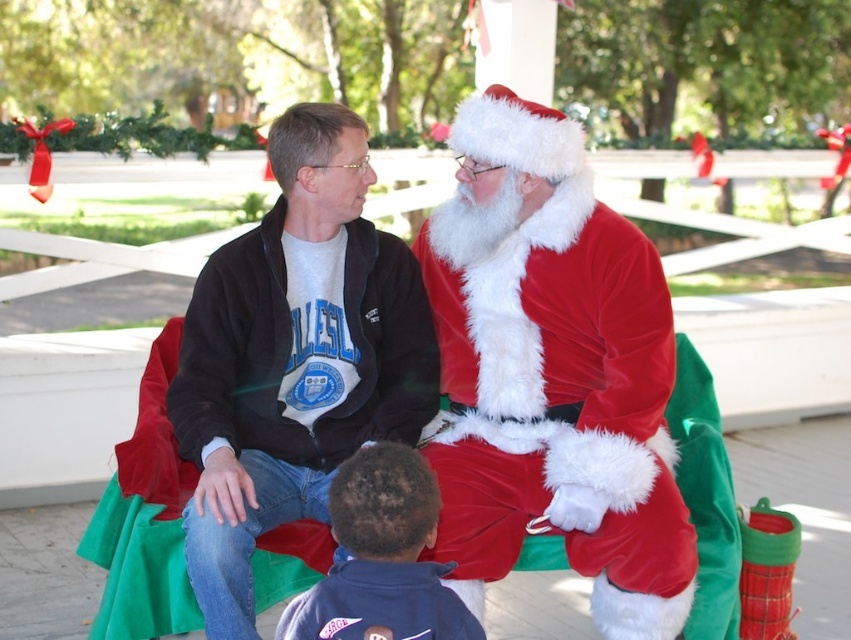
Question: Does velvet santa claus at center have a larger size compared to dark blue fleece jacket at lower center?

Choices:
 (A) yes
 (B) no

Answer: (A)

Question: Which point is closer to the camera?

Choices:
 (A) dark blue fleece jacket at lower center
 (B) velvet santa claus at center

Answer: (A)

Question: Can you confirm if velvet santa claus at center is positioned above matte black jacket at center?

Choices:
 (A) yes
 (B) no

Answer: (A)

Question: Estimate the real-world distances between objects in this image. Which object is closer to the matte black jacket at center?

Choices:
 (A) dark blue fleece jacket at lower center
 (B) velvet santa claus at center

Answer: (B)

Question: Is velvet santa claus at center positioned in front of dark blue fleece jacket at lower center?

Choices:
 (A) yes
 (B) no

Answer: (B)

Question: Among these objects, which one is nearest to the camera?

Choices:
 (A) velvet santa claus at center
 (B) dark blue fleece jacket at lower center

Answer: (B)